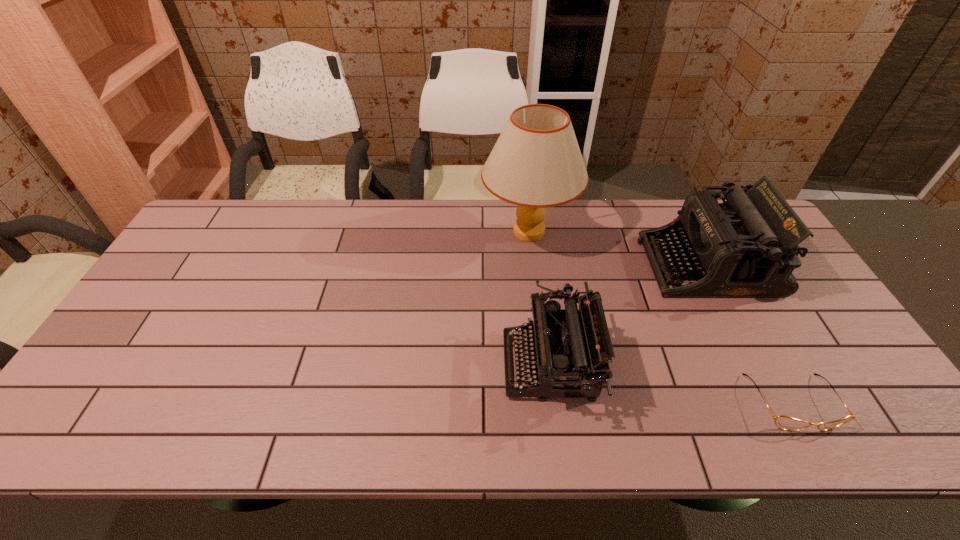
The width and height of the screenshot is (960, 540). I want to click on object situated at the near right corner, so click(783, 422).

Identify the location of vacant space at the far edge of the desktop. The width and height of the screenshot is (960, 540). (509, 232).

In the image, there is a desktop. Where is `free space at the near edge`? The image size is (960, 540). free space at the near edge is located at coordinates (503, 437).

Locate an element on the screen. The image size is (960, 540). vacant area at the left edge is located at coordinates (176, 325).

Locate an element on the screen. The image size is (960, 540). vacant space at the near left corner is located at coordinates (87, 409).

Where is `blank region between the third shortest object and the left typewriter`? This screenshot has width=960, height=540. blank region between the third shortest object and the left typewriter is located at coordinates (629, 315).

At what (x,y) coordinates should I click in order to perform the action: click on free spot between the shortest object and the nearer typewriter. Please return your answer as a coordinate pair (x, y). Looking at the image, I should click on (671, 384).

The height and width of the screenshot is (540, 960). Identify the location of vacant space in between the left typewriter and the right typewriter. (629, 315).

The image size is (960, 540). I want to click on vacant area that lies between the lampshade and the third shortest object, so click(618, 248).

Image resolution: width=960 pixels, height=540 pixels. Identify the location of empty space that is in between the shorter typewriter and the shortest object. (671, 384).